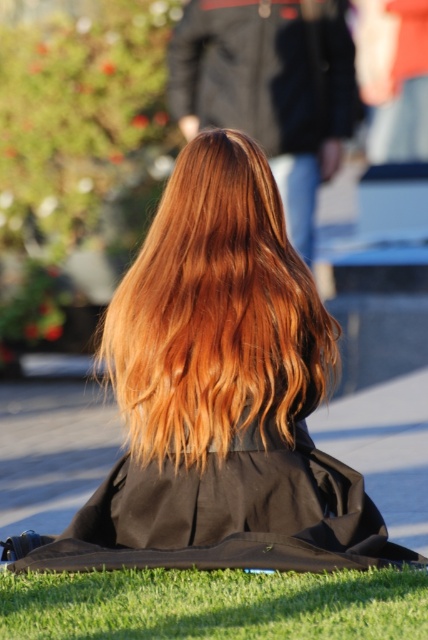
Question: Is shiny copper hair at center smaller than green grass at lower center?

Choices:
 (A) no
 (B) yes

Answer: (A)

Question: Which object is positioned closest to the black matte robe at center?

Choices:
 (A) shiny black robe at center
 (B) shiny brown hair at center
 (C) green grass at lower center

Answer: (C)

Question: Considering the relative positions of black matte robe at center and shiny black robe at center in the image provided, where is black matte robe at center located with respect to shiny black robe at center?

Choices:
 (A) above
 (B) below

Answer: (B)

Question: Which is nearer to the green grass at lower center?

Choices:
 (A) shiny copper hair at center
 (B) shiny brown hair at center
 (C) shiny black robe at center
 (D) black matte robe at center

Answer: (D)

Question: Based on their relative distances, which object is farther from the shiny black robe at center?

Choices:
 (A) green grass at lower center
 (B) shiny copper hair at center

Answer: (A)

Question: Can you confirm if shiny copper hair at center is positioned below green grass at lower center?

Choices:
 (A) yes
 (B) no

Answer: (B)